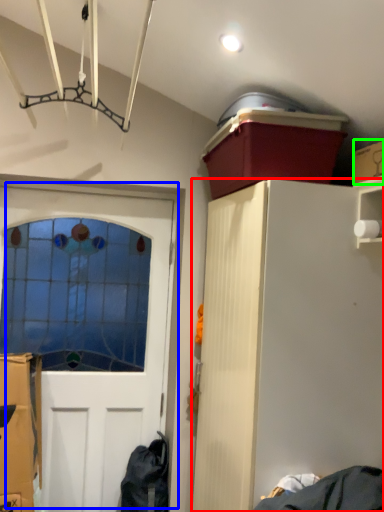
Question: Which object is the farthest from cabinetry (highlighted by a red box)? Choose among these: door (highlighted by a blue box) or cardboard box (highlighted by a green box).

Choices:
 (A) door
 (B) cardboard box

Answer: (A)